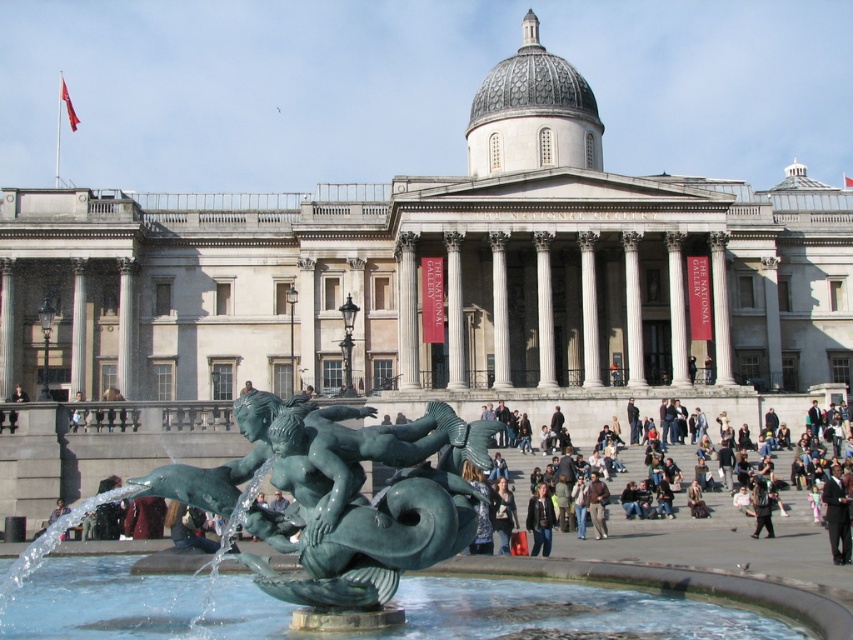
You are standing in front of The National Gallery and notice two items in the scene. One is the green patina bronze at lower center and the other is the dark brown leather jacket at lower right. Based on their positions, which item is higher up in the image?

The green patina bronze at lower center is located above the dark brown leather jacket at lower right, so the green patina bronze at lower center is higher up in the image.

You are standing at point (341, 496) in the image. What object is located at that exact point?

The green polished bronze sculpture at center is located at point (341, 496).